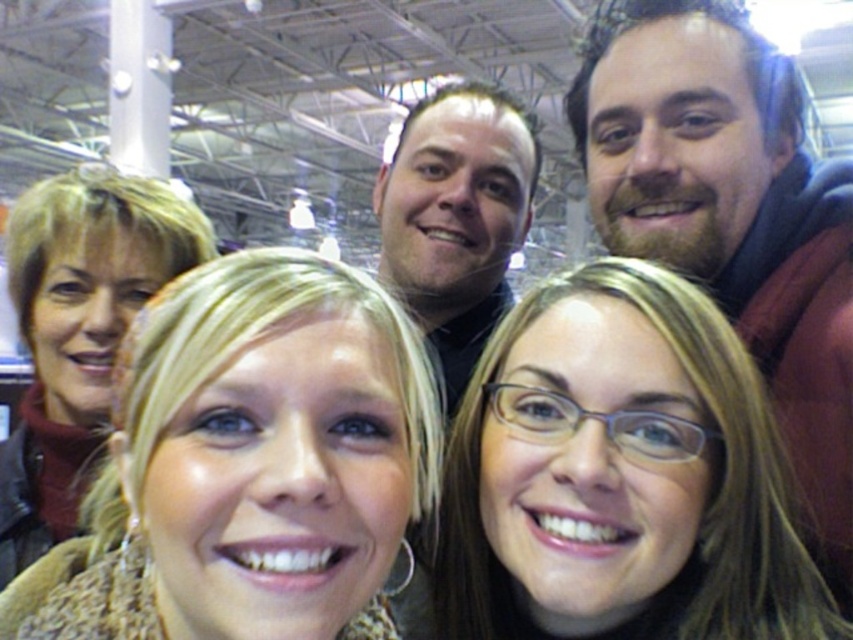
You are a photographer trying to adjust the lighting for a group photo. You notice two people in the image with matte brown hair at center and dark brown hair at upper center. Which person has a hairstyle that is shorter in height?

The matte brown hair at center has a hairstyle that is shorter in height than the dark brown hair at upper center.

Looking at this image, you are a photographer standing 2 feet away from the group. You want to adjust your camera to focus on both the matte brown jacket at left and the dark brown hair at upper center. Can you do this without changing your position? Explain why or why not.

The distance between the matte brown jacket at left and the dark brown hair at upper center is 17.00 inches. Since the photographer is only 2 feet away, the depth of field at this distance may be too shallow to keep both objects in focus simultaneously without adjusting the camera settings or moving closer. However, without specific aperture and lens information, it is difficult to determine definitively.